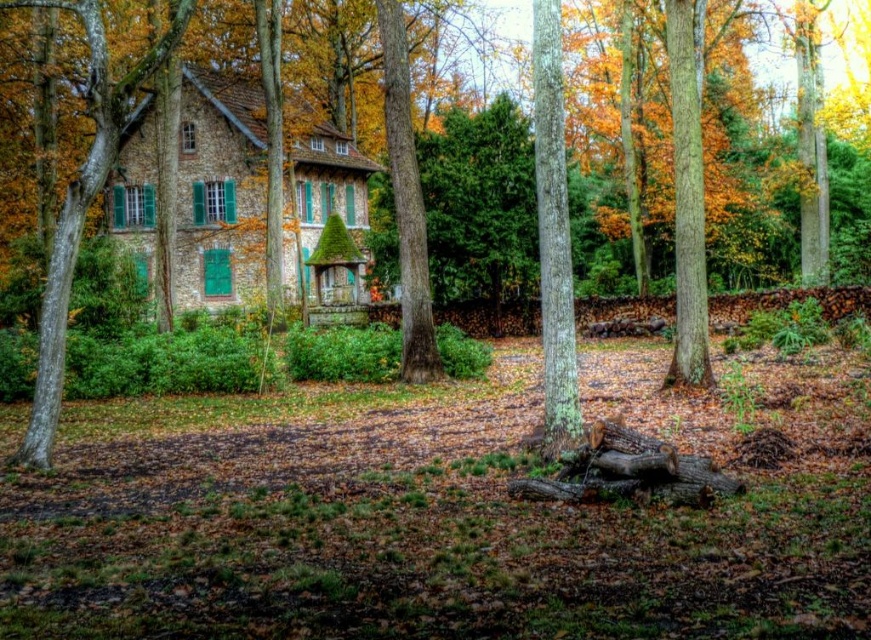
Question: Does green mossy bark tree at center appear on the right side of green rough bark tree at center?

Choices:
 (A) yes
 (B) no

Answer: (A)

Question: Is smooth bark tree at left wider than green mossy bark tree at center?

Choices:
 (A) yes
 (B) no

Answer: (A)

Question: Among these points, which one is nearest to the camera?

Choices:
 (A) (396, 209)
 (B) (544, 189)
 (C) (704, 282)
 (D) (71, 236)

Answer: (B)

Question: Estimate the real-world distances between objects in this image. Which object is closer to the green rough bark tree at center?

Choices:
 (A) smooth brown tree trunk at right
 (B) green mossy bark tree at center

Answer: (B)

Question: Can you confirm if green mossy bark tree at center is wider than green rough bark tree at center?

Choices:
 (A) yes
 (B) no

Answer: (A)

Question: Considering the real-world distances, which object is farthest from the smooth brown tree trunk at right?

Choices:
 (A) green rough bark tree at center
 (B) green mossy bark tree at center

Answer: (A)